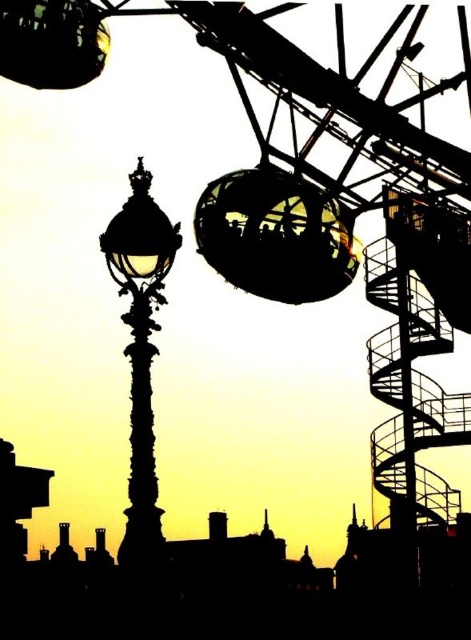
Question: Is spiral steel staircase at right further to camera compared to silhouette ornate street light at left?

Choices:
 (A) no
 (B) yes

Answer: (A)

Question: Which of the following is the closest to the observer?

Choices:
 (A) (443, 339)
 (B) (289, 189)
 (C) (155, 276)

Answer: (B)

Question: Estimate the real-world distances between objects in this image. Which object is farther from the spiral steel staircase at right?

Choices:
 (A) silhouette ornate street light at left
 (B) metallic glass sphere at upper center

Answer: (A)

Question: Considering the real-world distances, which object is farthest from the spiral steel staircase at right?

Choices:
 (A) silhouette ornate street light at left
 (B) metallic glass sphere at upper center

Answer: (A)

Question: Can you confirm if metallic glass sphere at upper center is wider than silhouette ornate street light at left?

Choices:
 (A) no
 (B) yes

Answer: (B)

Question: Can you confirm if metallic glass sphere at upper center is wider than silhouette ornate street light at left?

Choices:
 (A) yes
 (B) no

Answer: (A)